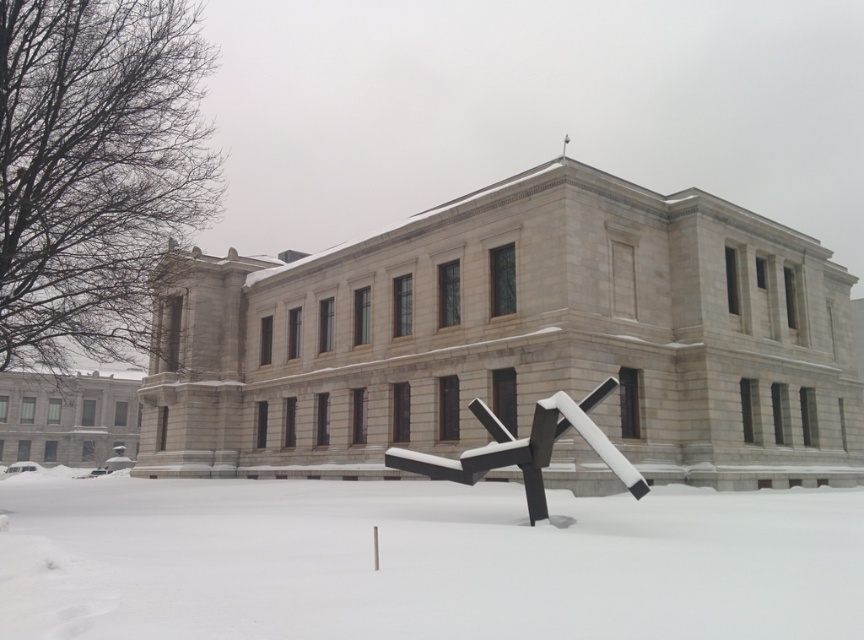
You are an architect assessing the building site. You need to determine if the black matte sculpture at center can be placed on the white powdery snow at center without sinking. Based on their heights, can the sculpture be placed there?

The white powdery snow at center has a greater height than the black matte sculpture at center. Since the snow is deeper, the sculpture can be placed on it without sinking as the snow can support its weight.

You are standing in front of the classical building and want to place a small decorative flag exactly where the white powdery snow at center is located. What are the coordinates of the spot where you should place the flag?

The coordinates for the white powdery snow at center are at point (x=422, y=561), so you should place the flag at those coordinates.

You are standing in front of the classical building and see two points marked on the ground. The first point is at coordinates point (503, 561) and the second is at point (521, 465). Which point is closer to the modern abstract sculpture?

Point (503, 561) is in front of point (521, 465), so it is closer to the modern abstract sculpture since it is positioned closer to the front of the building where the sculpture stands.